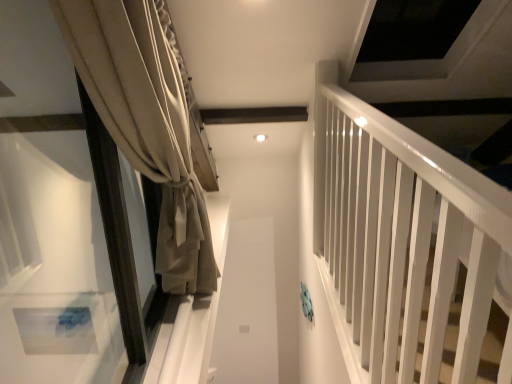
Question: Can you confirm if beige fabric curtain at left is thinner than white glossy rail at right?

Choices:
 (A) yes
 (B) no

Answer: (A)

Question: Is beige fabric curtain at left closer to camera compared to white glossy rail at right?

Choices:
 (A) yes
 (B) no

Answer: (B)

Question: From a real-world perspective, is beige fabric curtain at left located beneath white glossy rail at right?

Choices:
 (A) no
 (B) yes

Answer: (A)

Question: Considering the relative sizes of beige fabric curtain at left and white glossy rail at right in the image provided, is beige fabric curtain at left wider than white glossy rail at right?

Choices:
 (A) no
 (B) yes

Answer: (A)

Question: Can you confirm if beige fabric curtain at left is smaller than white glossy rail at right?

Choices:
 (A) no
 (B) yes

Answer: (B)

Question: Is beige fabric curtain at left at the left side of white glossy rail at right?

Choices:
 (A) no
 (B) yes

Answer: (B)

Question: Is white glossy rail at right thinner than beige fabric curtain at left?

Choices:
 (A) yes
 (B) no

Answer: (B)

Question: Does white glossy rail at right contain beige fabric curtain at left?

Choices:
 (A) no
 (B) yes

Answer: (A)

Question: Does white glossy rail at right come behind beige fabric curtain at left?

Choices:
 (A) no
 (B) yes

Answer: (A)

Question: Considering the relative positions of white glossy rail at right and beige fabric curtain at left in the image provided, is white glossy rail at right to the right of beige fabric curtain at left from the viewer's perspective?

Choices:
 (A) yes
 (B) no

Answer: (A)

Question: Is white glossy rail at right facing away from beige fabric curtain at left?

Choices:
 (A) no
 (B) yes

Answer: (A)

Question: From the image's perspective, is white glossy rail at right on beige fabric curtain at left?

Choices:
 (A) yes
 (B) no

Answer: (B)

Question: Looking at the image, does white glossy rail at right seem bigger or smaller compared to beige fabric curtain at left?

Choices:
 (A) small
 (B) big

Answer: (B)